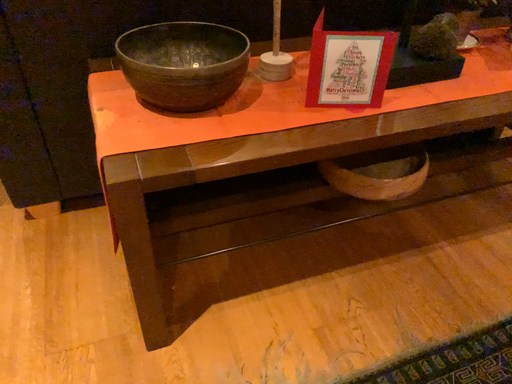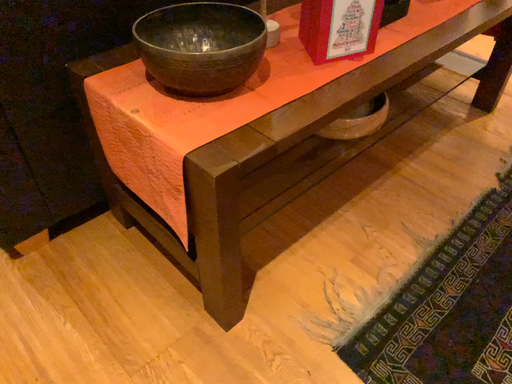
Question: Which way did the camera rotate in the video?

Choices:
 (A) rotated right
 (B) rotated left

Answer: (A)